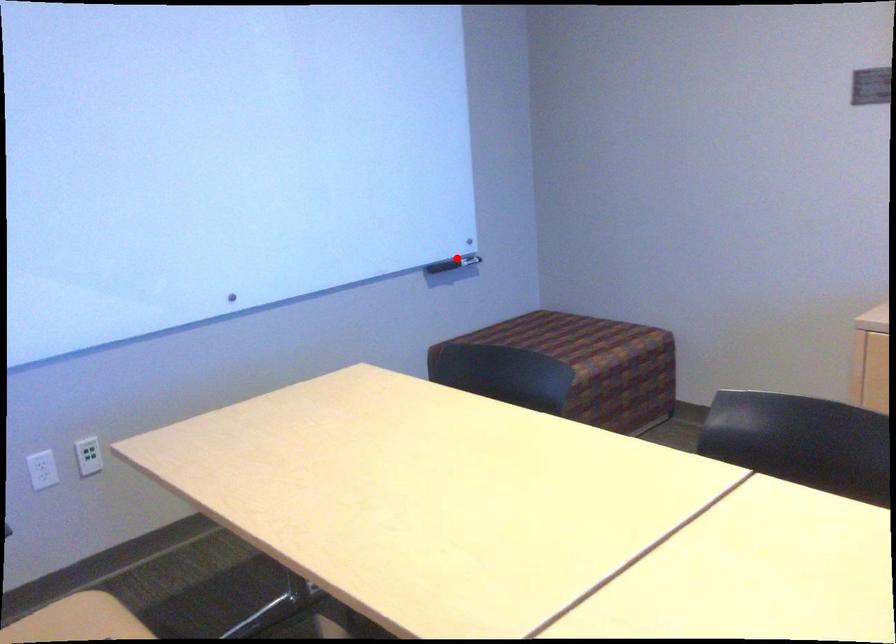
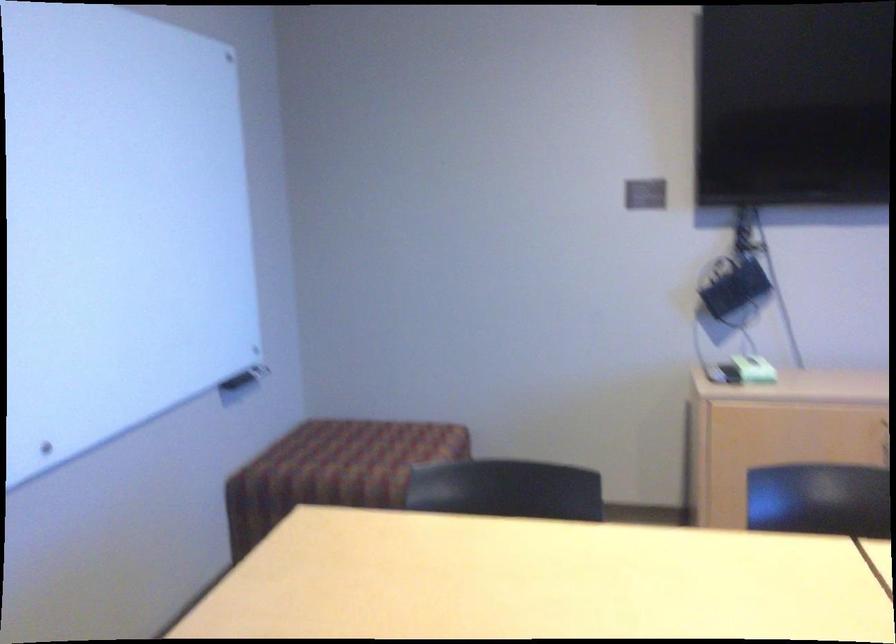
Question: I am providing you with two images of the same scene from different viewpoints. Given a red point in image1, look at the same physical point in image2. Is it:

Choices:
 (A) Closer to the viewpoint
 (B) Farther from the viewpoint

Answer: (A)